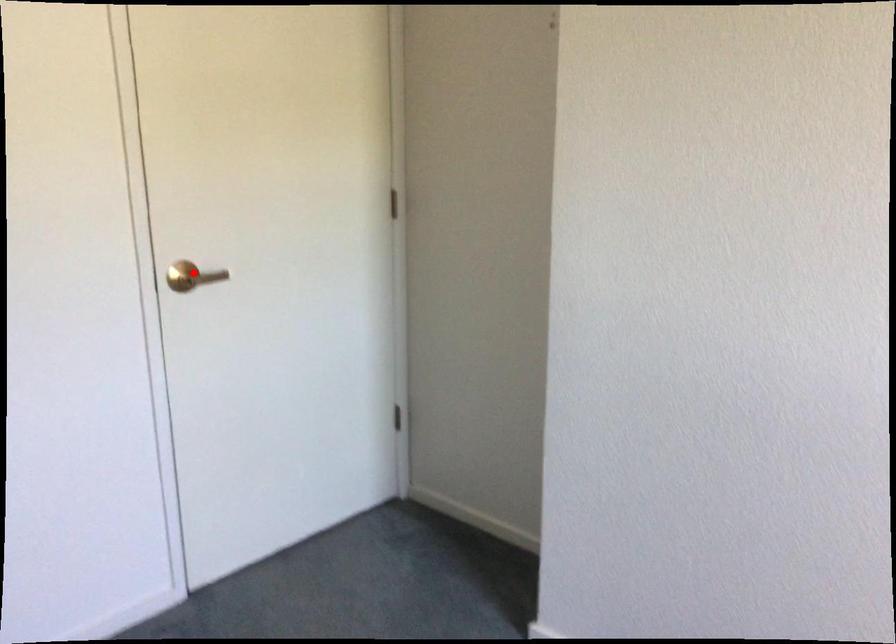
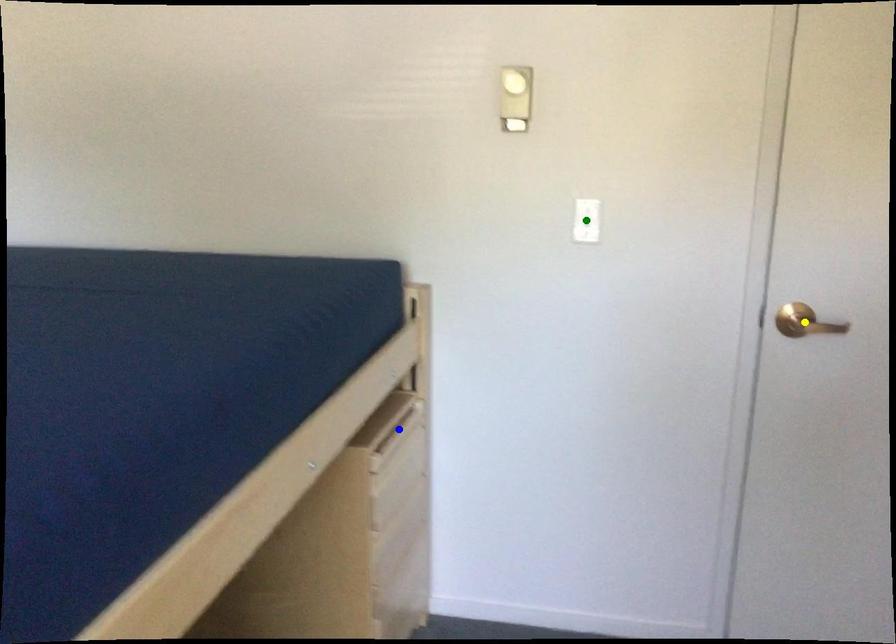
Question: I am providing you with two images of the same scene from different viewpoints. A red point is marked on the first image. You are given multiple points on the second image. In image 2, which mark is for the same physical point as the one in image 1?

Choices:
 (A) yellow point
 (B) green point
 (C) blue point

Answer: (A)